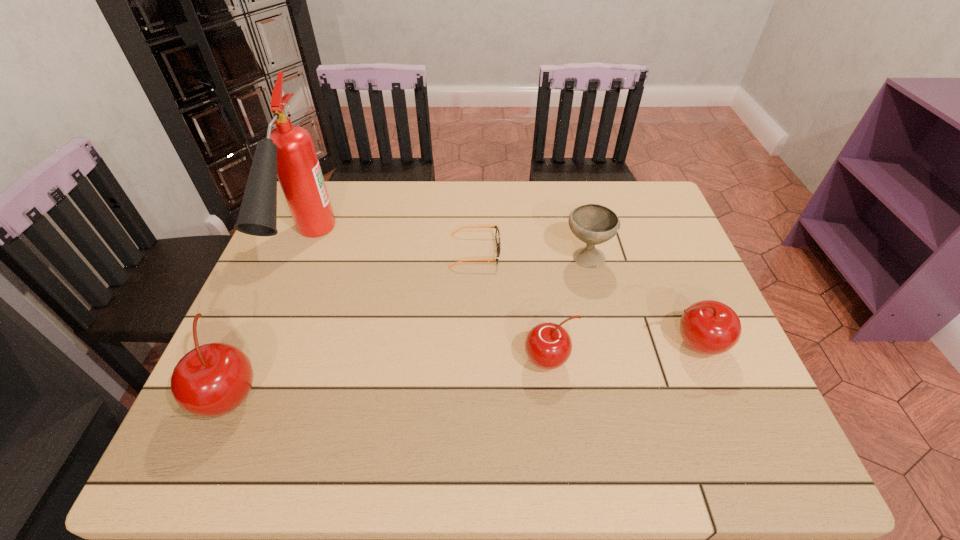
Image resolution: width=960 pixels, height=540 pixels. I want to click on the closest cherry to the leftmost cherry, so click(548, 346).

Locate an element on the screen. This screenshot has width=960, height=540. blank area in the image that satisfies the following two spatial constraints: 1. on the front side of the rightmost cherry; 2. on the right side of the chalice is located at coordinates (607, 345).

The width and height of the screenshot is (960, 540). Identify the location of vacant space that satisfies the following two spatial constraints: 1. on the front-facing side of the second object from right to left; 2. on the right side of the shortest object. (475, 258).

Image resolution: width=960 pixels, height=540 pixels. Find the location of `free location that satisfies the following two spatial constraints: 1. on the front-facing side of the fourth object from right to left; 2. on the right side of the rightmost cherry`. free location that satisfies the following two spatial constraints: 1. on the front-facing side of the fourth object from right to left; 2. on the right side of the rightmost cherry is located at coordinates (474, 345).

Where is `free spot that satisfies the following two spatial constraints: 1. on the front-facing side of the spectacles; 2. on the left side of the second cherry from left to right`? The height and width of the screenshot is (540, 960). free spot that satisfies the following two spatial constraints: 1. on the front-facing side of the spectacles; 2. on the left side of the second cherry from left to right is located at coordinates (474, 360).

You are a GUI agent. You are given a task and a screenshot of the screen. Output one action in this format:
    pyautogui.click(x=<x>, y=<y>)
    Task: Click on the vacant space that satisfies the following two spatial constraints: 1. at the nozzle of the second cherry from left to right; 2. on the left side of the tallest object
    The image size is (960, 540).
    Given the screenshot: What is the action you would take?
    pyautogui.click(x=263, y=360)

Image resolution: width=960 pixels, height=540 pixels. Identify the location of blank space that satisfies the following two spatial constraints: 1. at the nozzle of the tallest object; 2. on the left side of the chalice. (304, 258).

The height and width of the screenshot is (540, 960). Find the location of `vacant space that satisfies the following two spatial constraints: 1. on the front-facing side of the shortest object; 2. on the front side of the leftmost cherry`. vacant space that satisfies the following two spatial constraints: 1. on the front-facing side of the shortest object; 2. on the front side of the leftmost cherry is located at coordinates (473, 394).

Where is `vacant space that satisfies the following two spatial constraints: 1. at the nozzle of the tallest object; 2. on the right side of the second object from right to left`? Image resolution: width=960 pixels, height=540 pixels. vacant space that satisfies the following two spatial constraints: 1. at the nozzle of the tallest object; 2. on the right side of the second object from right to left is located at coordinates (304, 258).